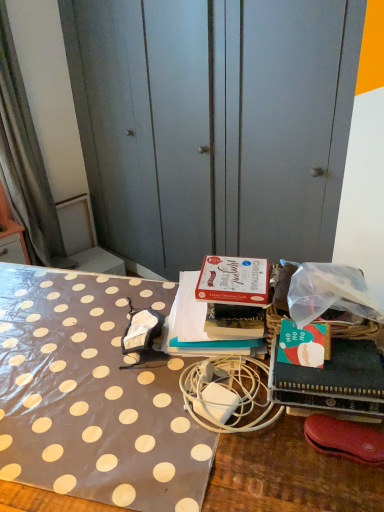
Question: From the image's perspective, is polka dot fabric at center located above or below matte cardboard box at center, the 1th book in the back-to-front sequence?

Choices:
 (A) above
 (B) below

Answer: (B)

Question: Choose the correct answer: Is polka dot fabric at center inside matte cardboard box at center, the 1th book in the back-to-front sequence, or outside it?

Choices:
 (A) outside
 (B) inside

Answer: (A)

Question: Estimate the real-world distances between objects in this image. Which object is farther from the gray fabric curtain at left?

Choices:
 (A) polka dot fabric at left
 (B) leather-like red shoe at lower right
 (C) green matte book at right, the 1th book positioned from the front
 (D) matte cardboard box at center, the 1th book in the back-to-front sequence
 (E) white matte charger at center

Answer: (B)

Question: Which is nearer to the polka dot fabric at center?

Choices:
 (A) matte cardboard box at center, the 1th book in the back-to-front sequence
 (B) polka dot fabric at left
 (C) white matte charger at center
 (D) leather-like red shoe at lower right
 (E) gray fabric curtain at left

Answer: (A)